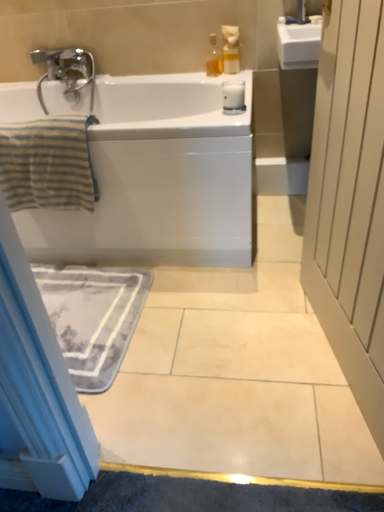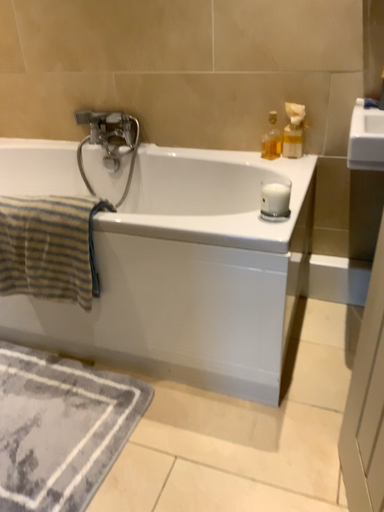
Question: Which way did the camera rotate in the video?

Choices:
 (A) rotated downward
 (B) rotated upward

Answer: (B)